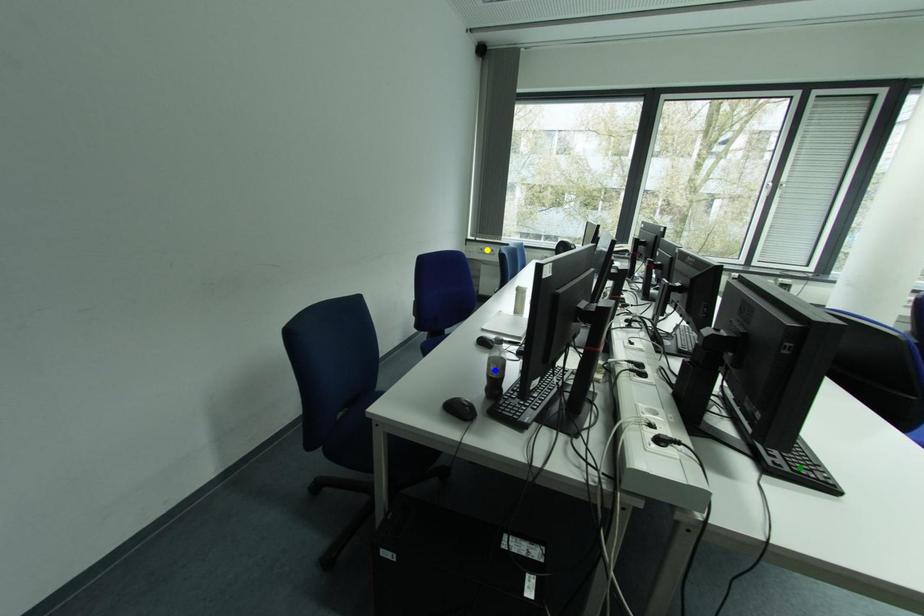
Order these from nearest to farthest:
green point | blue point | yellow point

green point < blue point < yellow point